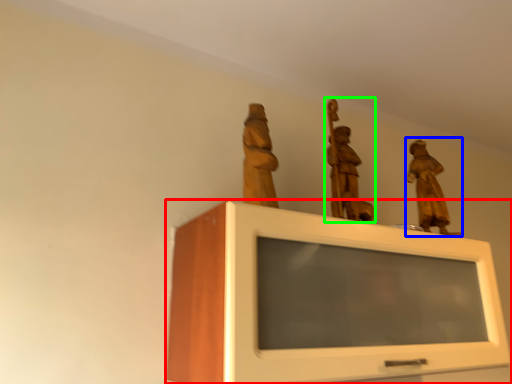
Question: Estimate the real-world distances between objects in this image. Which object is farther from furniture (highlighted by a red box), sculpture (highlighted by a blue box) or sculpture (highlighted by a green box)?

Choices:
 (A) sculpture
 (B) sculpture

Answer: (A)